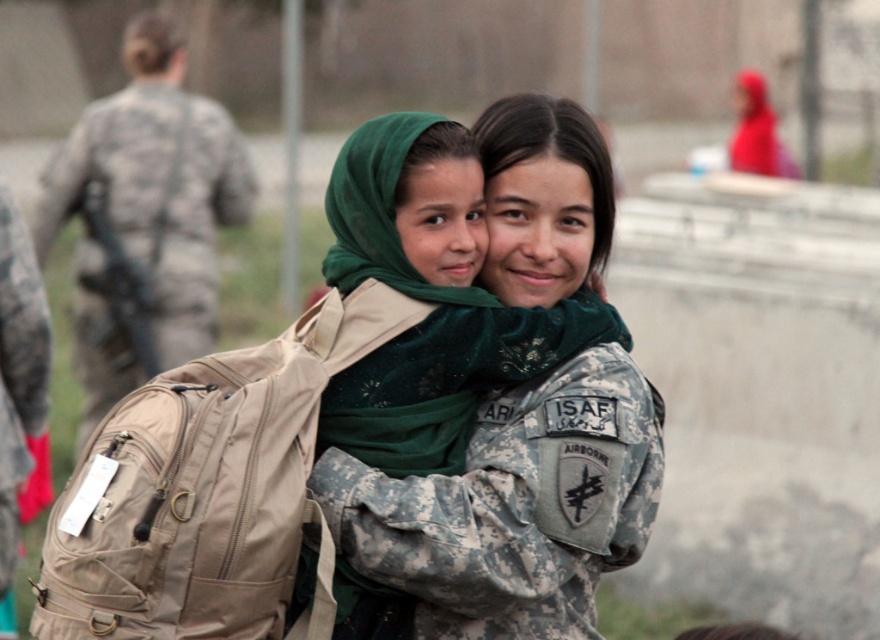
Question: Which of the following is the farthest from the observer?

Choices:
 (A) (463, 529)
 (B) (24, 397)

Answer: (B)

Question: Does camouflage uniform at center appear over camouflage fabric backpack at left?

Choices:
 (A) no
 (B) yes

Answer: (A)

Question: Which of the following is the farthest from the observer?

Choices:
 (A) camouflage fabric backpack at left
 (B) camouflage uniform at center

Answer: (A)

Question: Is the position of camouflage uniform at center less distant than that of camouflage fabric uniform at left?

Choices:
 (A) yes
 (B) no

Answer: (A)

Question: Which of the following is the closest to the observer?

Choices:
 (A) camouflage fabric backpack at left
 (B) camouflage fabric uniform at left
 (C) camouflage uniform at center

Answer: (C)

Question: Is camouflage uniform at center to the left of camouflage fabric backpack at left from the viewer's perspective?

Choices:
 (A) no
 (B) yes

Answer: (A)